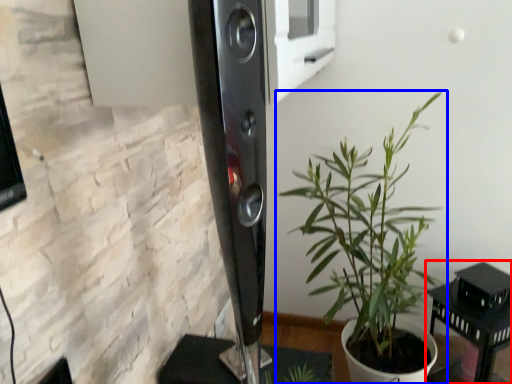
Question: Which object appears farthest to the camera in this image, furniture (highlighted by a red box) or houseplant (highlighted by a blue box)?

Choices:
 (A) furniture
 (B) houseplant

Answer: (A)